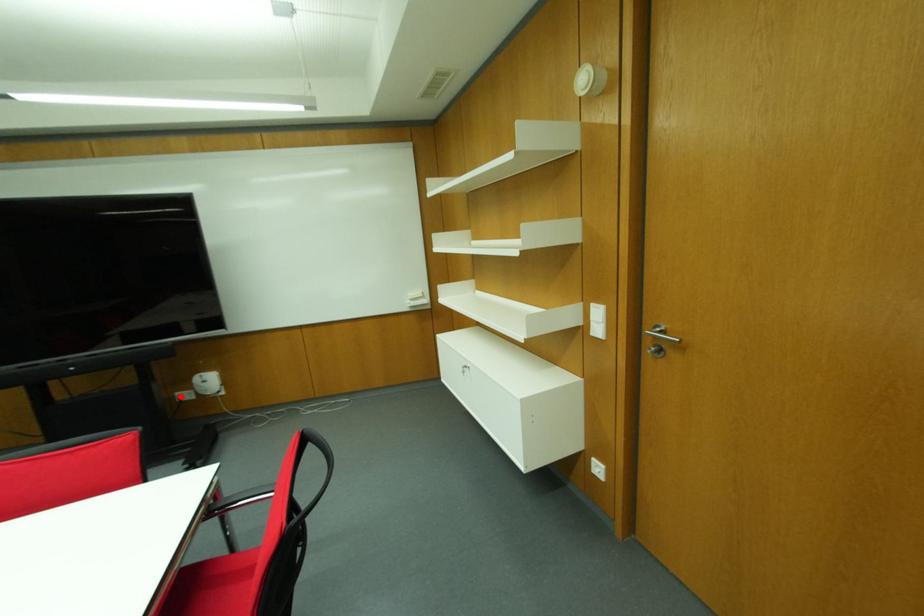
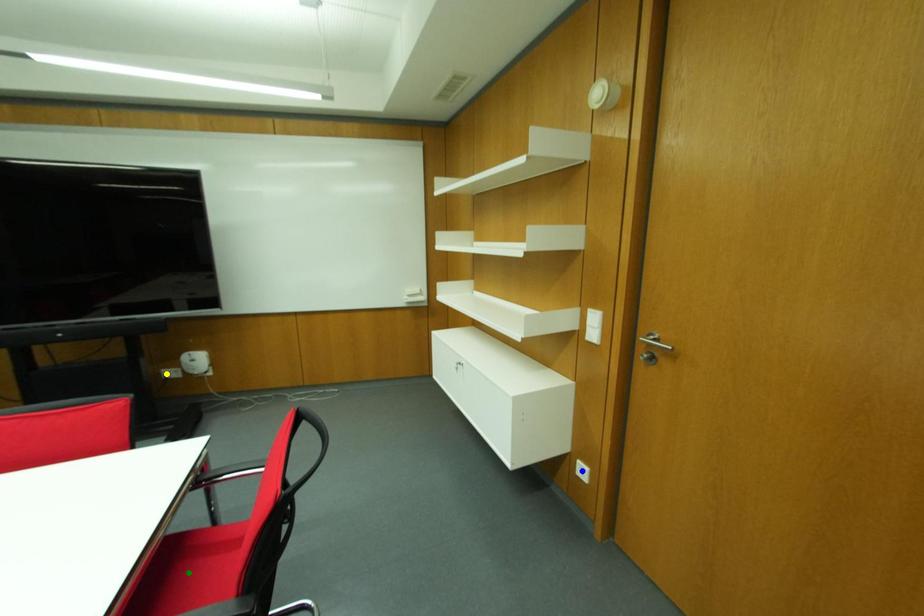
Question: I am providing you with two images of the same scene from different viewpoints. A red point is marked on the first image. You are given multiple points on the second image. Which point in image 2 is actually the same real-world point as the red point in image 1?

Choices:
 (A) yellow point
 (B) green point
 (C) blue point

Answer: (A)